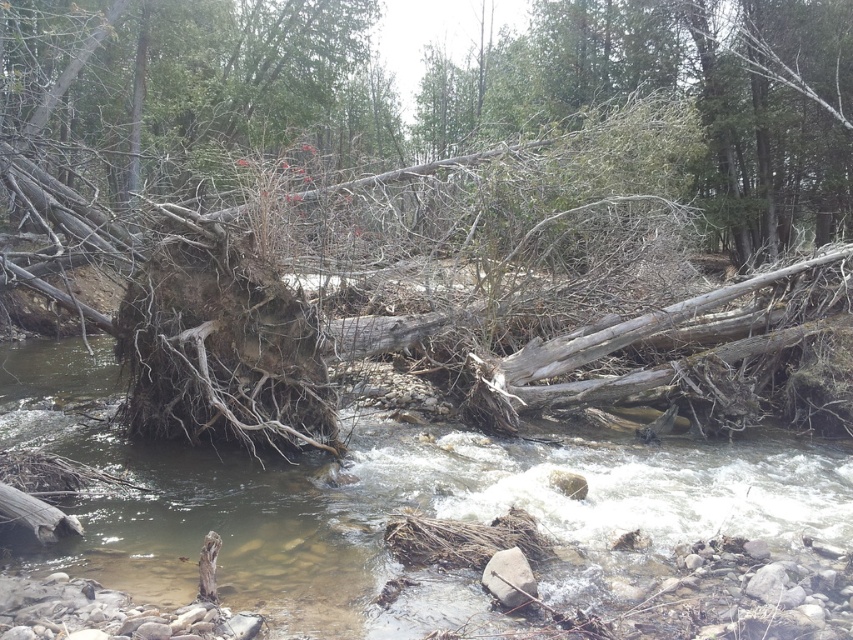
Who is higher up, brown wood at center or gray rough rock at center?

brown wood at center is above.

Locate an element on the screen. brown wood at center is located at coordinates (389, 504).